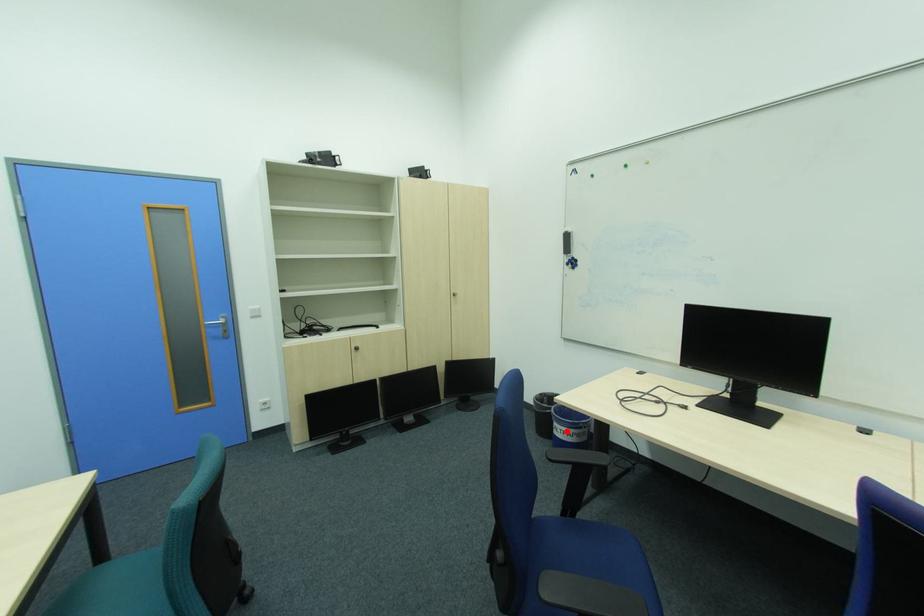
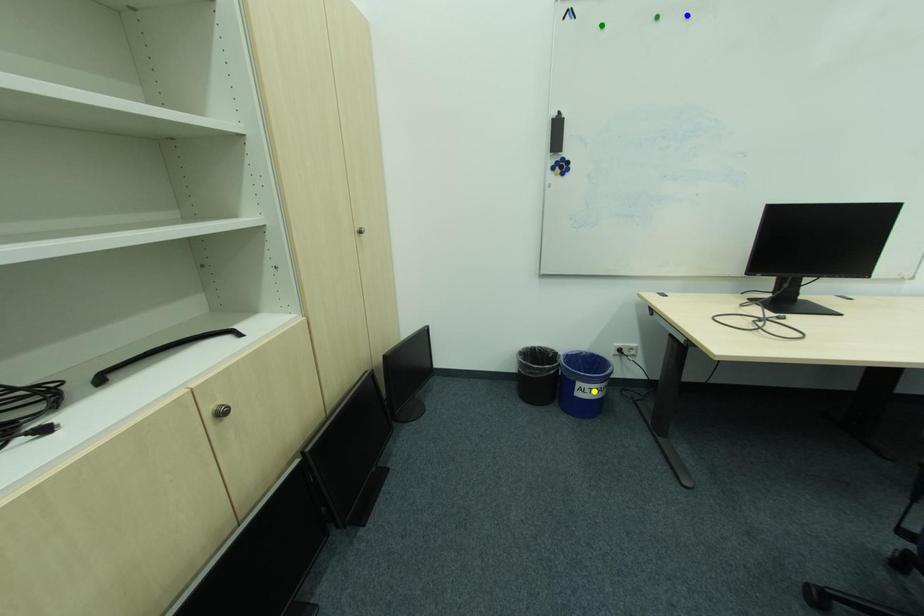
Question: I am providing you with two images of the same scene from different viewpoints. A red point is marked on the first image. You are given multiple points on the second image. Which point in image 2 is actually the same real-world point as the red point in image 1?

Choices:
 (A) green point
 (B) yellow point
 (C) blue point

Answer: (B)